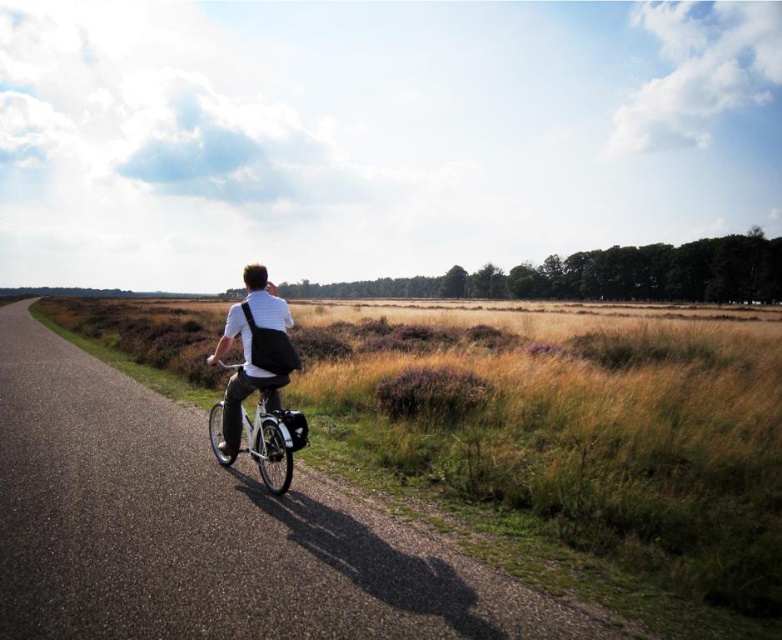
Which of these two, asphalt road at center or white metallic bicycle at center, stands taller?

Standing taller between the two is asphalt road at center.

Based on the photo, is asphalt road at center shorter than white metallic bicycle at center?

No, asphalt road at center is not shorter than white metallic bicycle at center.

Which is behind, point (49, 598) or point (293, 429)?

Positioned behind is point (293, 429).

The image size is (782, 640). I want to click on asphalt road at center, so click(207, 529).

What are the coordinates of `asphalt road at center` in the screenshot? It's located at 207,529.

Between asphalt road at center and matte black backpack at center, which one has less height?

With less height is asphalt road at center.

Which is behind, point (2, 552) or point (275, 296)?

Positioned behind is point (275, 296).

Where is `asphalt road at center`? The image size is (782, 640). asphalt road at center is located at coordinates (207, 529).

Is matte black backpack at center smaller than white metallic bicycle at center?

Correct, matte black backpack at center occupies less space than white metallic bicycle at center.

Is point (239, 330) farther from viewer compared to point (302, 445)?

That is True.

Identify the location of matte black backpack at center. This screenshot has width=782, height=640. (250, 352).